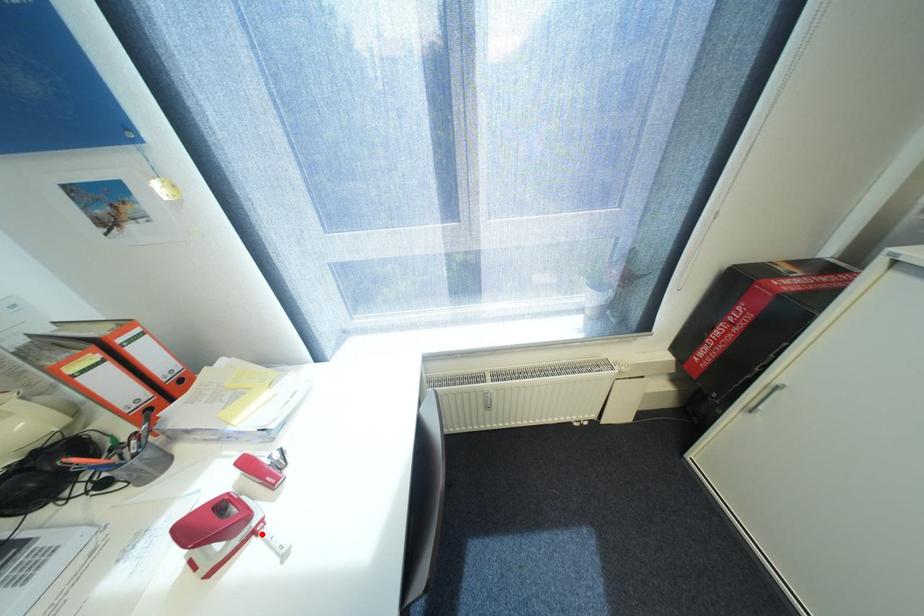
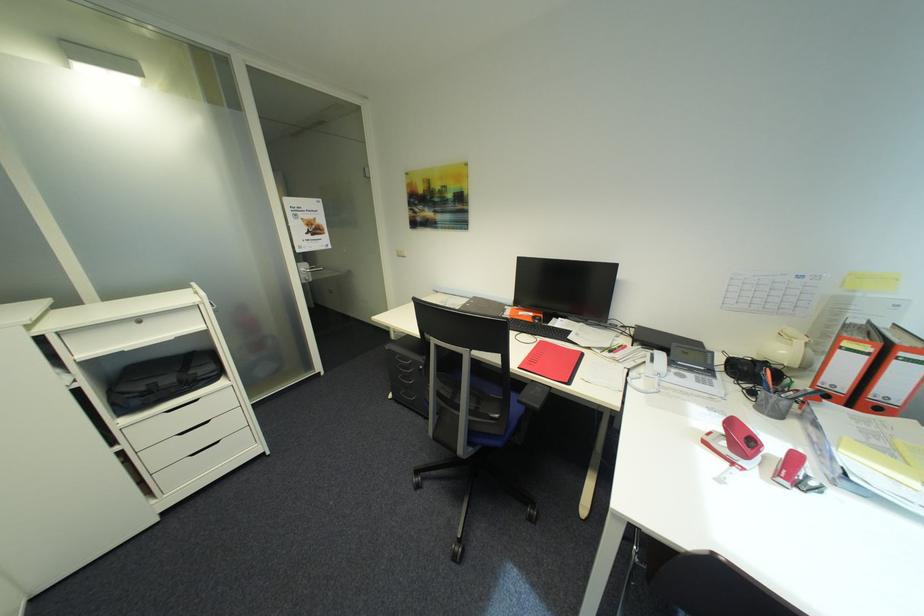
The point at the highlighted location is marked in the first image. Where is the corresponding point in the second image?

(742, 464)